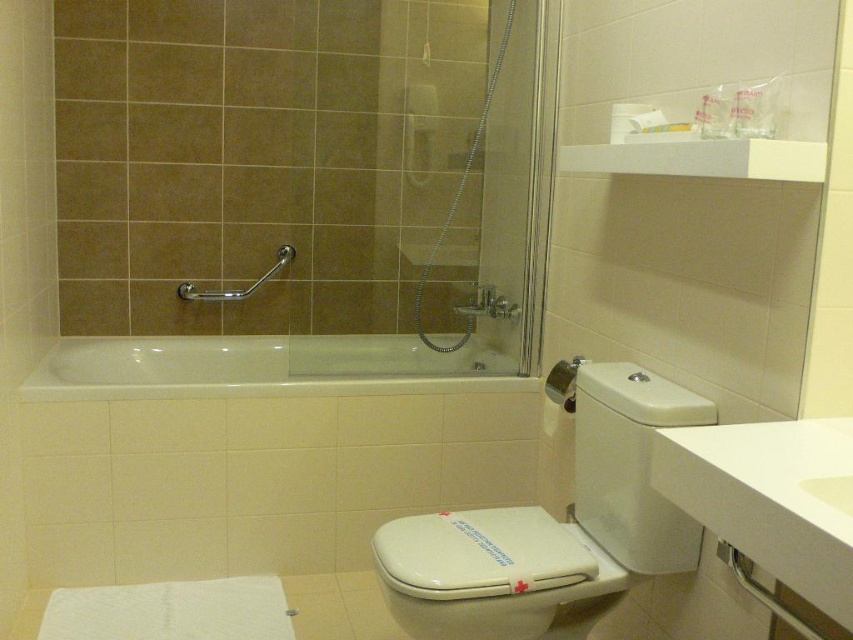
You are standing in the bathroom and need to wash your hands. The white glossy sink at lower right is where you need to go. Based on the bathroom layout, can you tell me the exact coordinates of the sink?

The white glossy sink at lower right is located at the coordinates point (770, 499).

You are a home inspector assessing bathroom safety. You notice the white glossy toilet at lower right and the satin nickel grab bar at upper left. Which object is taller?

The white glossy toilet at lower right is much taller than the satin nickel grab bar at upper left.

You are standing in the bathroom and want to wash your hands. Which object should you approach first, the white glossy sink at lower right or the satin nickel grab bar at upper left?

You should approach the white glossy sink at lower right first because it is closer to you than the satin nickel grab bar at upper left.